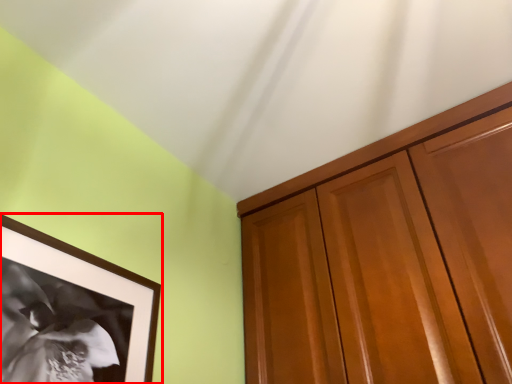
Question: In this image, where is picture frame (annotated by the red box) located relative to cabinetry?

Choices:
 (A) left
 (B) right

Answer: (A)